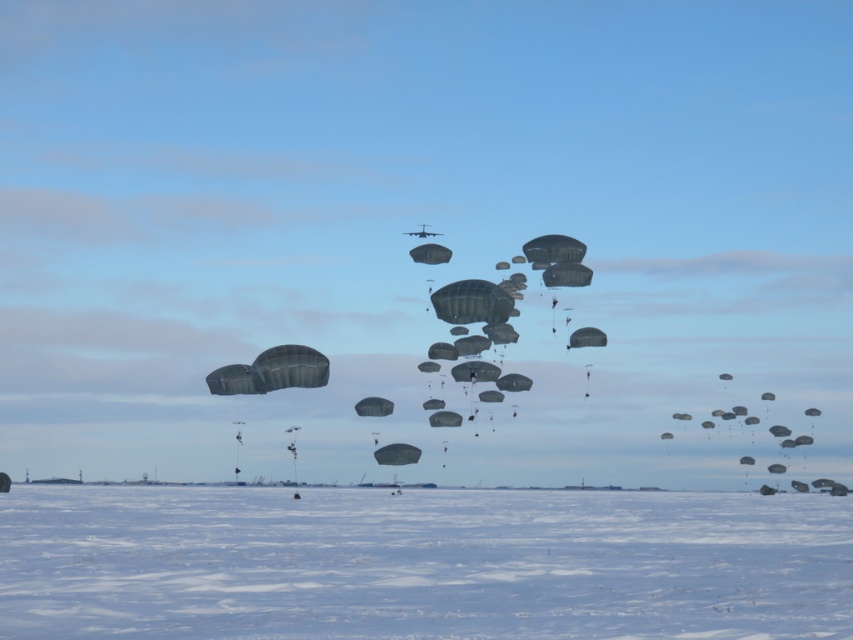
Which of these two, dark gray matte parachute at center or matte gray parachute at center, stands shorter?

matte gray parachute at center

Who is positioned more to the left, dark gray matte parachute at center or matte gray parachute at center?

dark gray matte parachute at center

Identify the location of dark gray matte parachute at center. This screenshot has height=640, width=853. (289, 368).

Is the position of white matte snow at lower center less distant than that of dark gray matte parachute at center?

Yes.

From the picture: Is white matte snow at lower center above dark gray matte parachute at center?

Actually, white matte snow at lower center is below dark gray matte parachute at center.

In order to click on white matte snow at lower center in this screenshot , I will do `click(421, 563)`.

You are a GUI agent. You are given a task and a screenshot of the screen. Output one action in this format:
    pyautogui.click(x=<x>, y=<y>)
    Task: Click on the white matte snow at lower center
    The image size is (853, 640).
    Given the screenshot: What is the action you would take?
    pyautogui.click(x=421, y=563)

Who is more forward, [456,632] or [399,452]?

Point [456,632]

Can you confirm if white matte snow at lower center is positioned to the right of matte gray parachute at center?

Yes, white matte snow at lower center is to the right of matte gray parachute at center.

Measure the distance between white matte snow at lower center and camera.

white matte snow at lower center is 14.88 meters away from camera.

This screenshot has height=640, width=853. In order to click on white matte snow at lower center in this screenshot , I will do `click(421, 563)`.